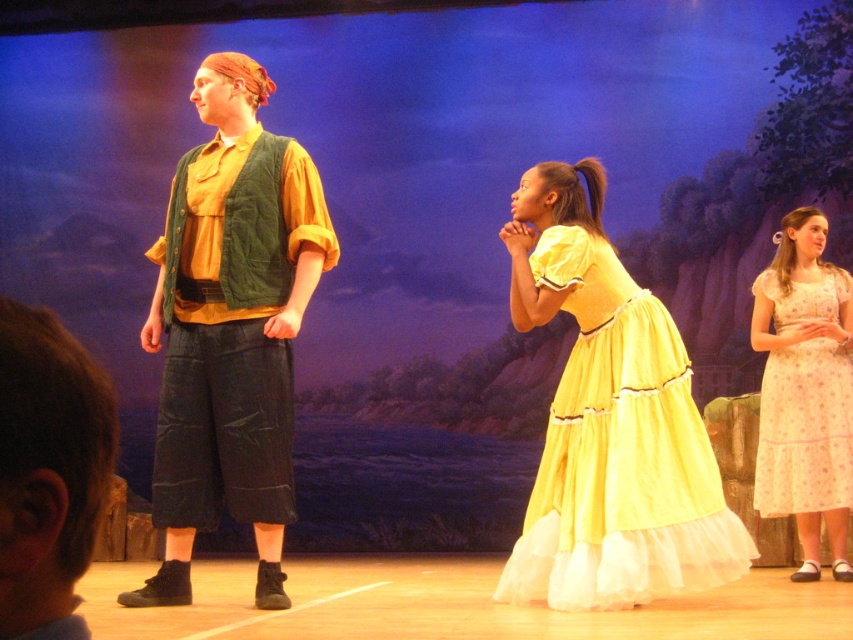
You are a stagehand who needs to adjust the spotlight for the performers. The spotlight can only cover one performer at a time. Since the yellow cotton dress at center is in front of the light pink polka dot dress at right, which performer should you focus the spotlight on to ensure both are visible without moving the light?

Since the yellow cotton dress at center is in front of the light pink polka dot dress at right, you should focus the spotlight on the yellow cotton dress at center. This way, the light will naturally illuminate both the front performer and the one behind them, ensuring both are visible without needing to move the spotlight.

Based on the coordinates provided, which object is located at point (x=230, y=328)?

The point (x=230, y=328) indicates the location of the matte green vest at left.